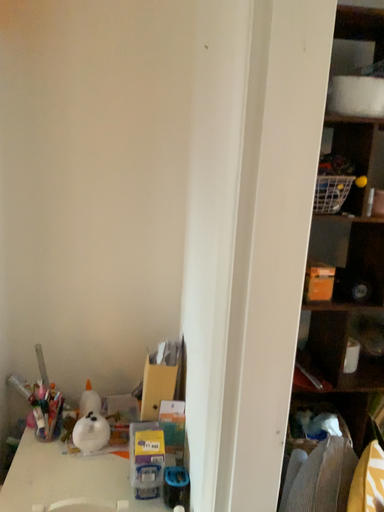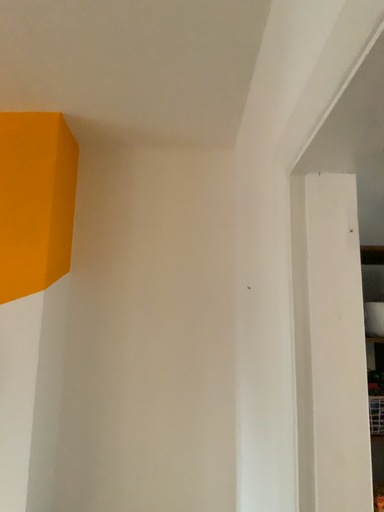
Question: Which way did the camera rotate in the video?

Choices:
 (A) rotated downward
 (B) rotated upward

Answer: (B)